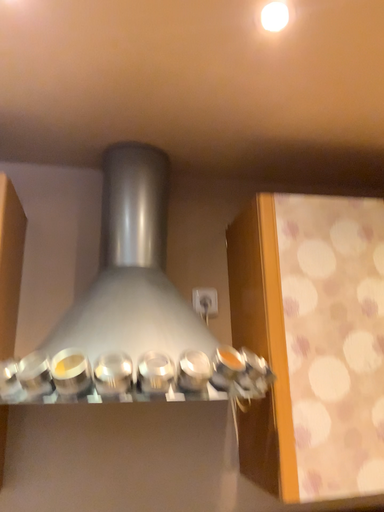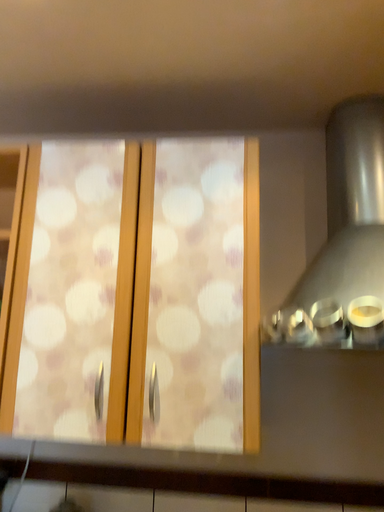
Question: Which way did the camera rotate in the video?

Choices:
 (A) rotated right
 (B) rotated left

Answer: (B)